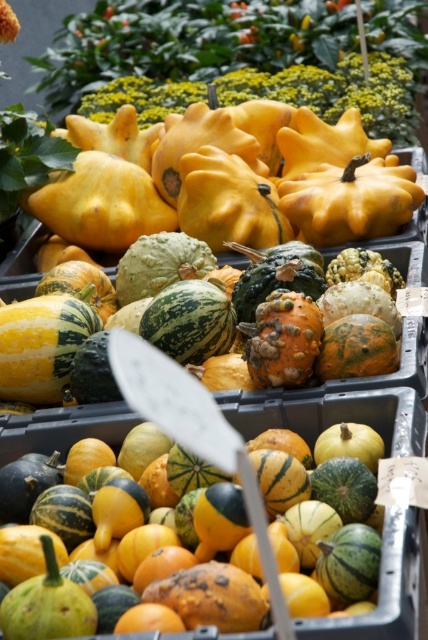
Does speckled orange squash at center appear under speckled green squash at center?

Yes.

Which is in front, point (234, 541) or point (389, 253)?

Point (234, 541) is more forward.

Between point (128, 488) and point (377, 378), which one is positioned in front?

Point (128, 488)

Where is `speckled orange squash at center`? The height and width of the screenshot is (640, 428). speckled orange squash at center is located at coordinates (158, 554).